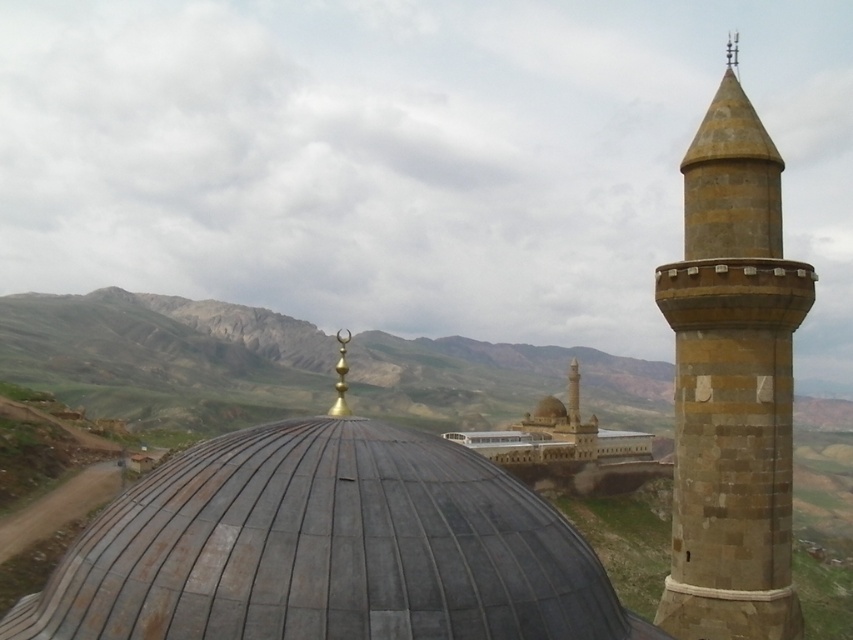
Question: Which object is closer to the camera taking this photo?

Choices:
 (A) gray tiled dome at center
 (B) brown stone tower at right

Answer: (A)

Question: Is gray tiled dome at center bigger than brown stone tower at right?

Choices:
 (A) no
 (B) yes

Answer: (B)

Question: Which point is closer to the camera taking this photo?

Choices:
 (A) (379, 461)
 (B) (766, 436)

Answer: (A)

Question: Where is gray tiled dome at center located in relation to brown stone tower at right in the image?

Choices:
 (A) left
 (B) right

Answer: (A)

Question: Does gray tiled dome at center appear under brown stone tower at right?

Choices:
 (A) no
 (B) yes

Answer: (B)